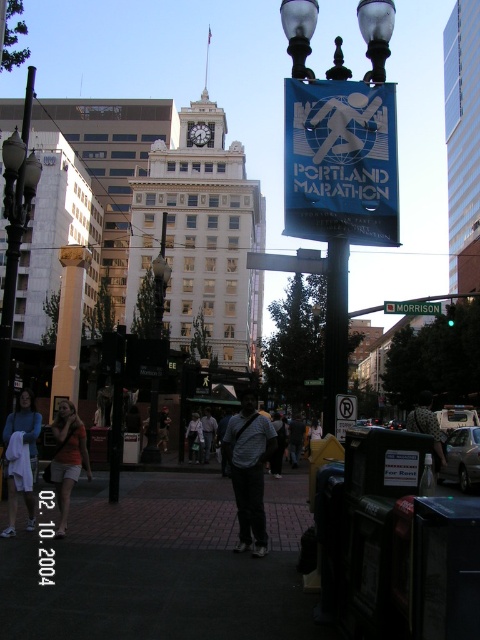
Question: Which of these objects is positioned farthest from the dark brick pavement at center?

Choices:
 (A) green metallic street sign at center
 (B) white glossy clock tower at center
 (C) orange t-shirt at center

Answer: (B)

Question: Is blue fabric sign at center bigger than metallic pole at right?

Choices:
 (A) yes
 (B) no

Answer: (A)

Question: Among these objects, which one is farthest from the camera?

Choices:
 (A) metallic pole at center
 (B) metallic pole at right
 (C) orange t-shirt at center

Answer: (C)

Question: Is white glossy clock tower at center to the right of metallic pole at right from the viewer's perspective?

Choices:
 (A) yes
 (B) no

Answer: (B)

Question: Which object is farther from the camera taking this photo?

Choices:
 (A) green metallic street sign at center
 (B) orange t-shirt at center

Answer: (A)

Question: Does metallic pole at center have a larger size compared to patterned fabric shirt at center?

Choices:
 (A) no
 (B) yes

Answer: (A)